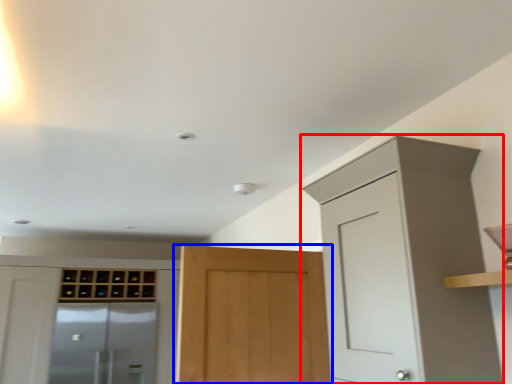
Question: Which of the following is the farthest to the observer, cabinetry (highlighted by a red box) or door (highlighted by a blue box)?

Choices:
 (A) cabinetry
 (B) door

Answer: (B)